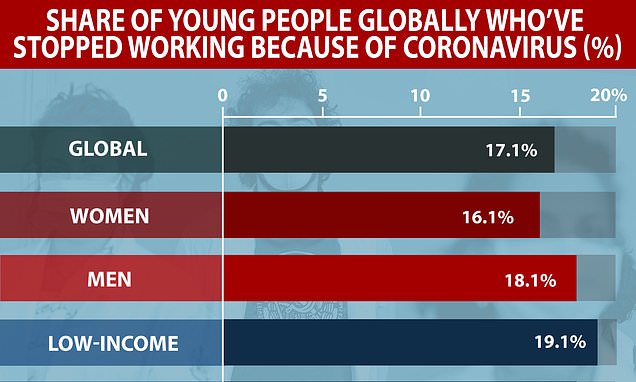
Where is `dark blue bar`? This screenshot has height=382, width=636. dark blue bar is located at coordinates (474, 346).